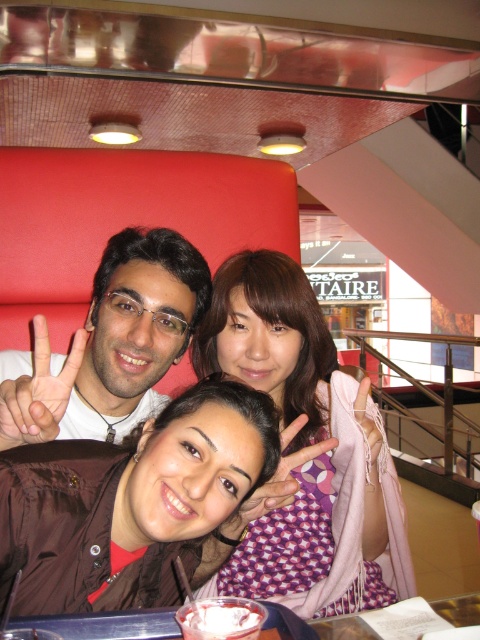
You are a photographer trying to adjust the lighting for a group photo. You need to ensure that both the purple dotted scarf at center and the matte white shirt at center are evenly lit. Given their positions, which object should you move closer to the light source to achieve balanced lighting?

The purple dotted scarf at center is to the right of the matte white shirt at center. To balance the lighting, move the purple dotted scarf at center closer to the light source since it is positioned further away from the center, ensuring both receive equal illumination.

What is the position of the purple dotted scarf at center relative to the matte black hand at center?

The purple dotted scarf at center is to the right of the matte black hand at center.

You are standing in the room and want to locate the matte white shirt at center. What are the coordinates where you can find it?

The matte white shirt at center is located at coordinates point (111, 342).